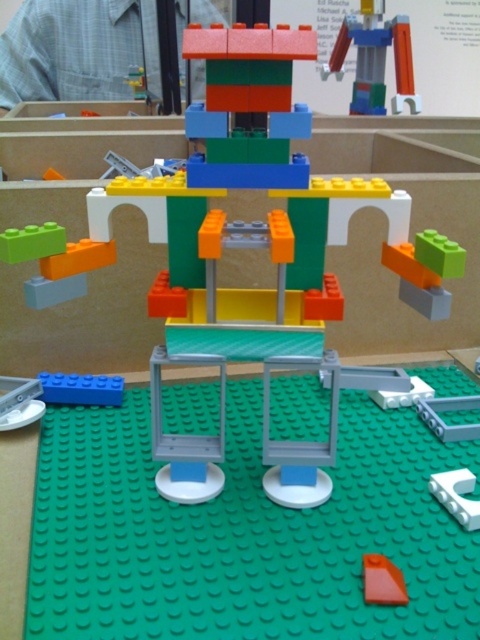
Can you confirm if brushed metal man at upper left is shorter than white matte plastic plate at lower right?

Incorrect, brushed metal man at upper left's height does not fall short of white matte plastic plate at lower right's.

Between point (33, 67) and point (439, 496), which one is positioned behind?

The point (33, 67) is behind.

The height and width of the screenshot is (640, 480). In order to click on brushed metal man at upper left in this screenshot , I will do `click(76, 51)`.

Which of these two, brushed metal man at upper left or orange matte triangle at center, stands shorter?

orange matte triangle at center

Can you confirm if brushed metal man at upper left is shorter than orange matte triangle at center?

In fact, brushed metal man at upper left may be taller than orange matte triangle at center.

This screenshot has width=480, height=640. Identify the location of brushed metal man at upper left. (76, 51).

Who is positioned more to the right, blue matte block at lower left or orange matte triangle at center?

orange matte triangle at center

Is blue matte block at lower left above orange matte triangle at center?

Yes, blue matte block at lower left is above orange matte triangle at center.

The height and width of the screenshot is (640, 480). I want to click on blue matte block at lower left, so click(81, 388).